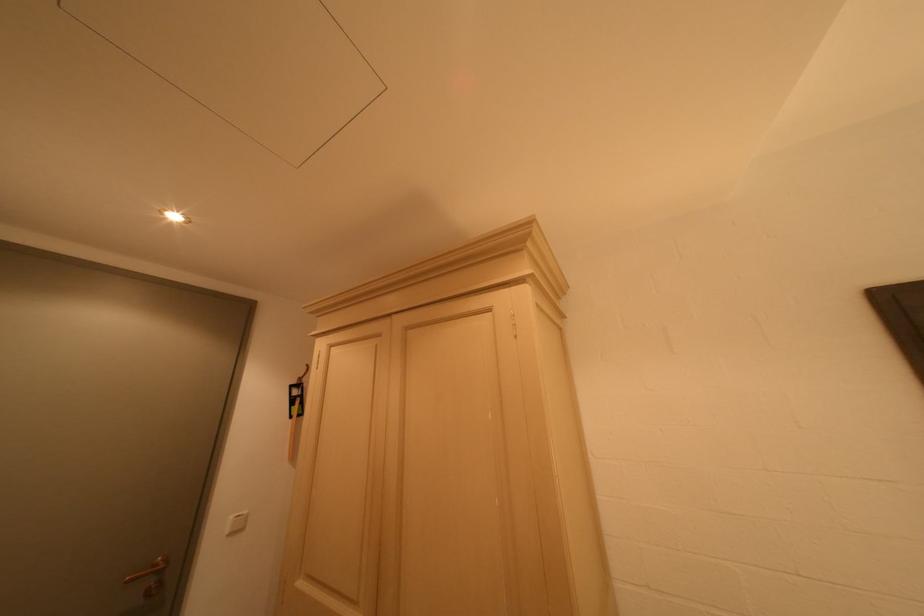
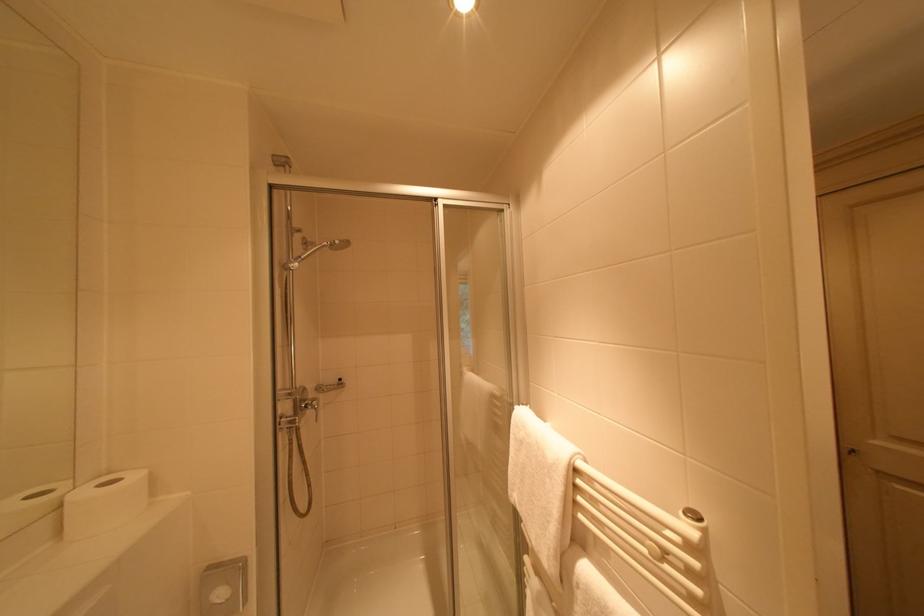
Question: The images are taken continuously from a first-person perspective. In which direction is your viewpoint rotating?

Choices:
 (A) Left
 (B) Right
 (C) Up
 (D) Down

Answer: (A)